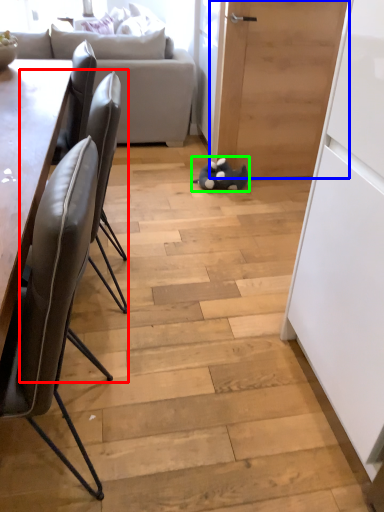
Question: Which object is positioned closest to chair (highlighted by a red box)? Select from door (highlighted by a blue box) and toy (highlighted by a green box).

Choices:
 (A) door
 (B) toy

Answer: (B)